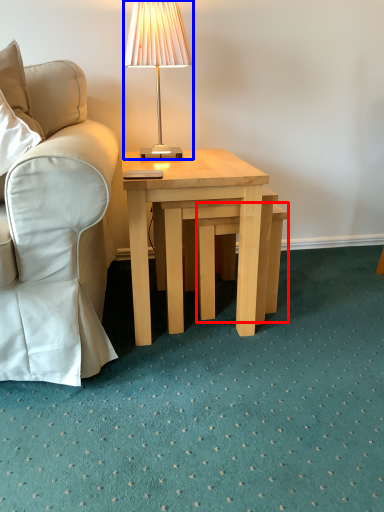
Question: Which point is closer to the camera, stool (highlighted by a red box) or lamp (highlighted by a blue box)?

Choices:
 (A) stool
 (B) lamp

Answer: (B)